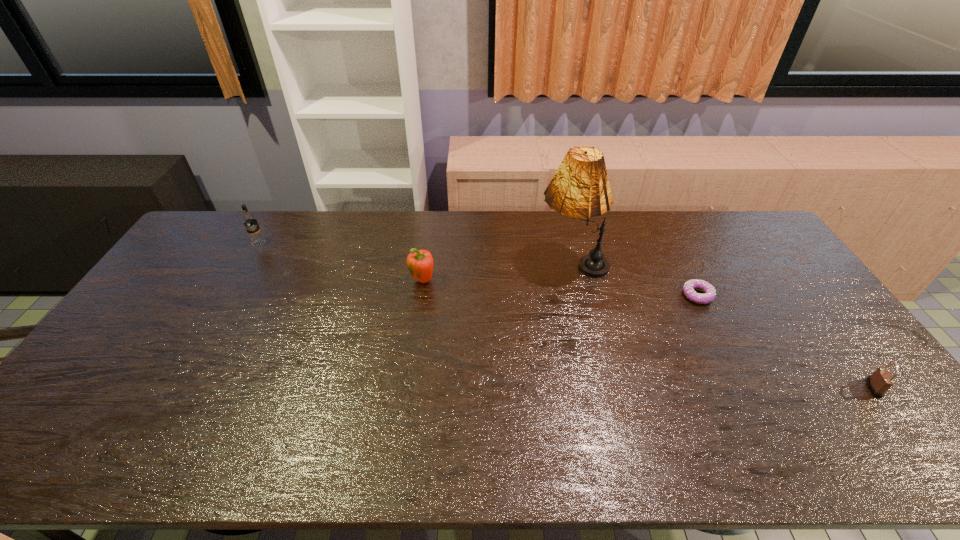
Locate an element on the screen. The height and width of the screenshot is (540, 960). the third object from right to left is located at coordinates (580, 188).

The image size is (960, 540). Find the location of `lampshade`. lampshade is located at coordinates (580, 188).

This screenshot has width=960, height=540. Find the location of `vodka`. vodka is located at coordinates pyautogui.click(x=249, y=220).

Locate an element on the screen. This screenshot has width=960, height=540. the third shortest object is located at coordinates (420, 263).

This screenshot has width=960, height=540. Identify the location of the fourth object from right to left. (420, 263).

Identify the location of the rightmost object. tap(881, 380).

This screenshot has height=540, width=960. In order to click on padlock in this screenshot , I will do point(881,380).

The height and width of the screenshot is (540, 960). Find the location of `doughnut`. doughnut is located at coordinates (688, 288).

This screenshot has height=540, width=960. What are the coordinates of `the fourth object from left to right` in the screenshot? It's located at (688, 288).

This screenshot has height=540, width=960. Find the location of `vacant area situated on the front-facing side of the third object from right to left`. vacant area situated on the front-facing side of the third object from right to left is located at coordinates (423, 263).